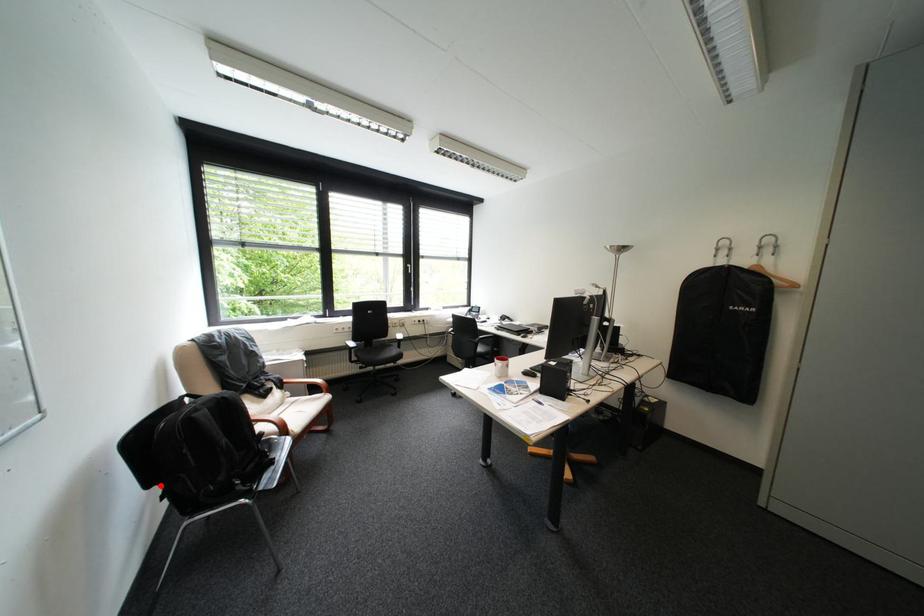
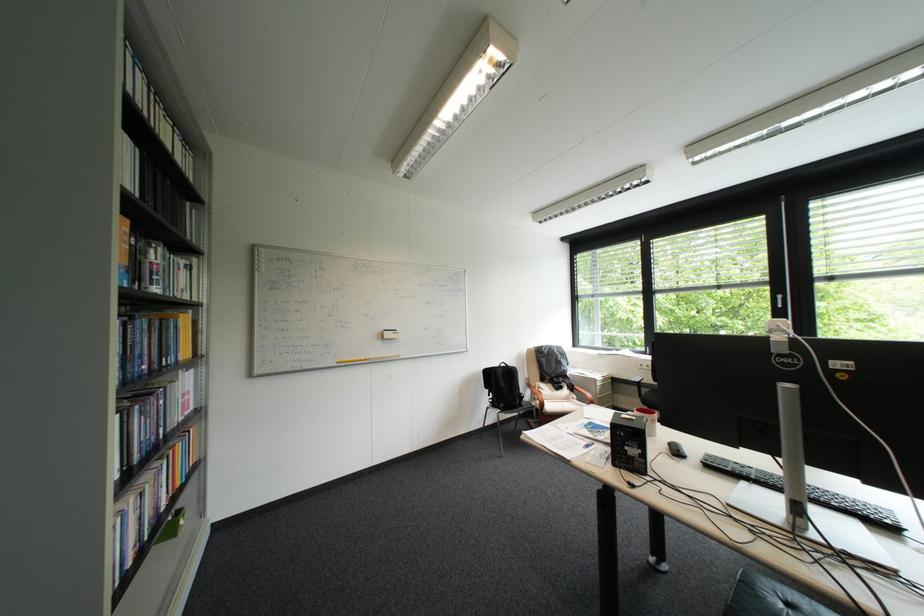
The point at the highlighted location is marked in the first image. Where is the corresponding point in the second image?

(497, 387)